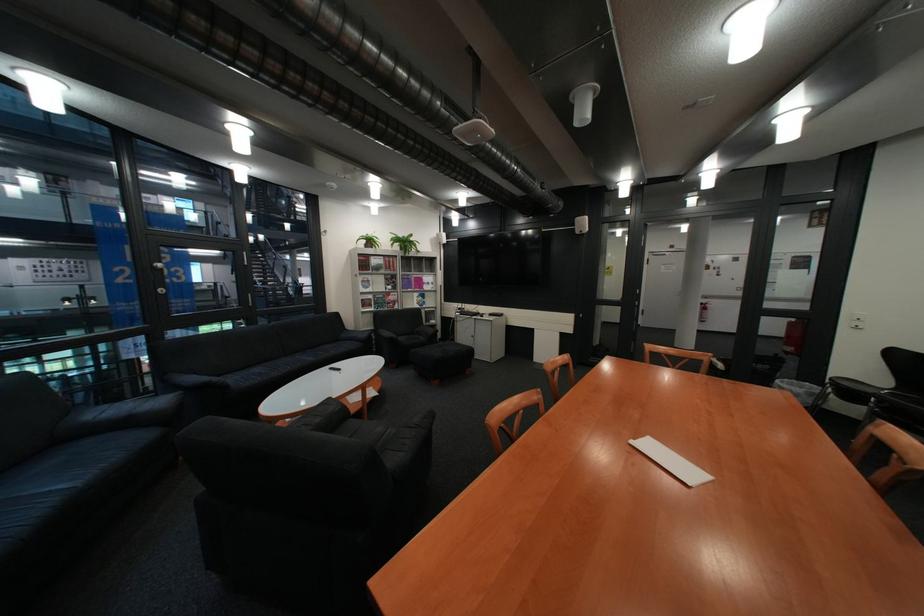
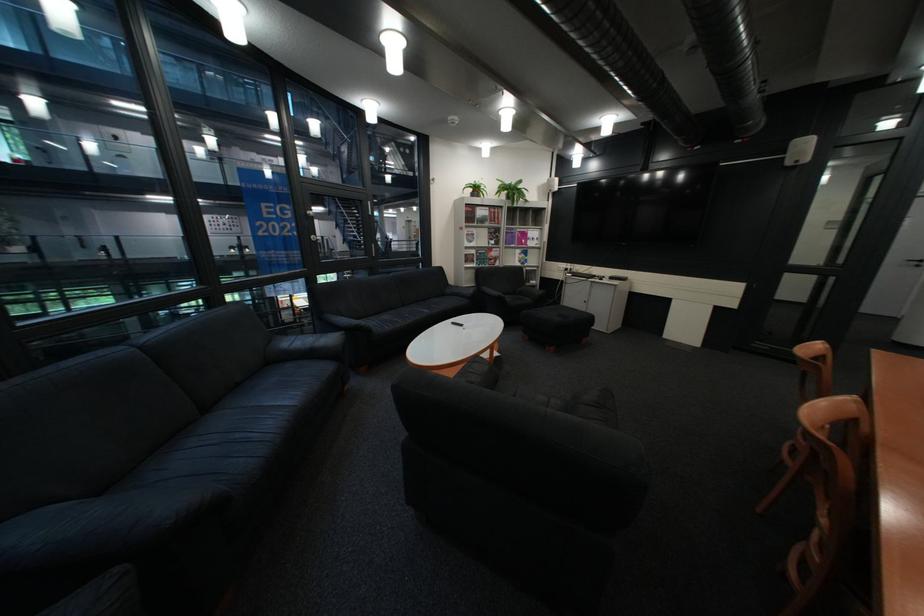
Find the pixel in the second image that matches [387,276] in the first image.

(492, 229)